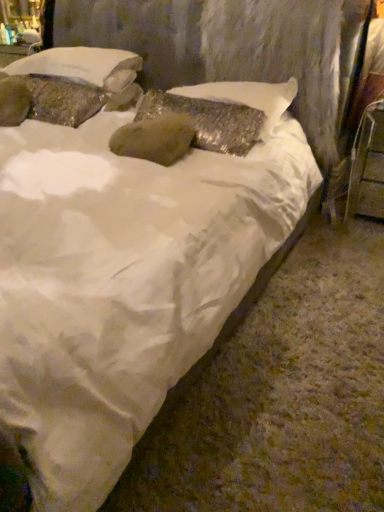
Find the location of `vacant area that lies in front of metallic silver chair at right`. vacant area that lies in front of metallic silver chair at right is located at coordinates (360, 237).